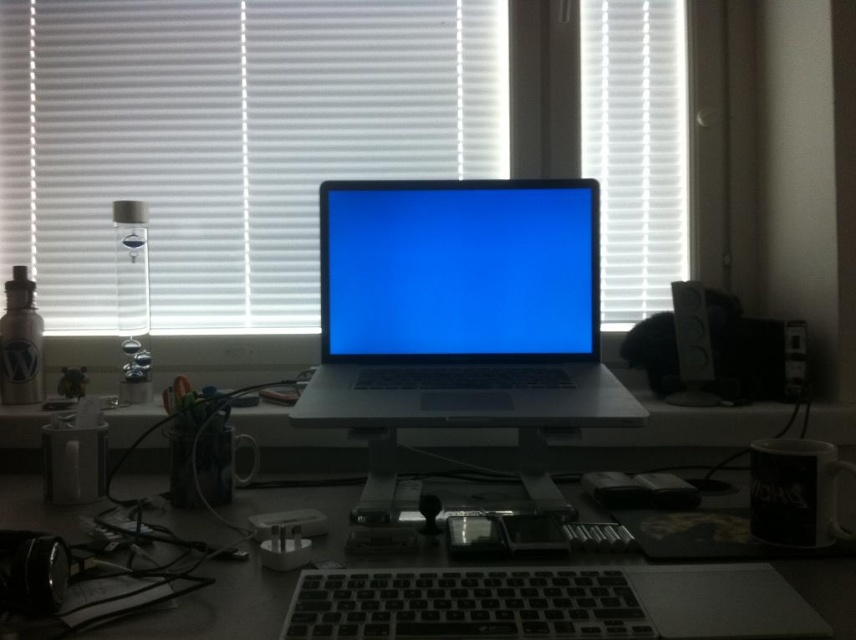
Question: Which point is closer to the camera taking this photo?

Choices:
 (A) (509, 353)
 (B) (214, 316)
 (C) (125, 625)

Answer: (C)

Question: Is sleek silver laptop at center smaller than white matte blinds at upper right?

Choices:
 (A) no
 (B) yes

Answer: (A)

Question: Is sleek silver laptop at center thinner than white matte blinds at upper right?

Choices:
 (A) no
 (B) yes

Answer: (A)

Question: Is white matte blinds at upper center behind black plastic keyboard at center?

Choices:
 (A) no
 (B) yes

Answer: (B)

Question: Which point appears farthest from the camera in this image?

Choices:
 (A) (60, 13)
 (B) (841, 637)

Answer: (A)

Question: Which object is positioned closest to the white matte blinds at upper center?

Choices:
 (A) black plastic keyboard at center
 (B) white matte blinds at upper right

Answer: (B)